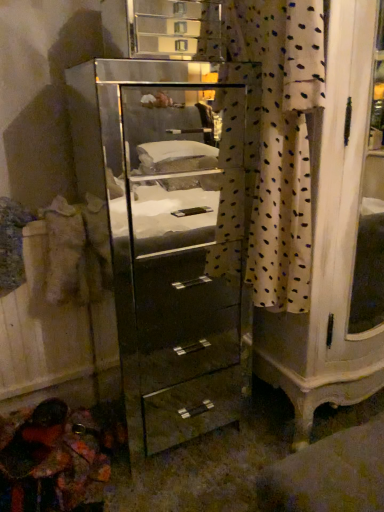
Question: Should I look upward or downward to see white dotted fabric at center?

Choices:
 (A) up
 (B) down

Answer: (A)

Question: Does mirror-finished glass chest of drawers at center have a smaller size compared to white dotted fabric at center?

Choices:
 (A) no
 (B) yes

Answer: (A)

Question: Is mirror-finished glass chest of drawers at center completely or partially outside of white dotted fabric at center?

Choices:
 (A) no
 (B) yes

Answer: (B)

Question: Can you confirm if mirror-finished glass chest of drawers at center is taller than white dotted fabric at center?

Choices:
 (A) yes
 (B) no

Answer: (A)

Question: Could you tell me if mirror-finished glass chest of drawers at center is facing white dotted fabric at center?

Choices:
 (A) no
 (B) yes

Answer: (B)

Question: Does mirror-finished glass chest of drawers at center have a lesser width compared to white dotted fabric at center?

Choices:
 (A) yes
 (B) no

Answer: (B)

Question: Is mirror-finished glass chest of drawers at center bigger than white dotted fabric at center?

Choices:
 (A) no
 (B) yes

Answer: (B)

Question: Would you consider white dotted fabric at center to be distant from mirror-finished glass chest of drawers at center?

Choices:
 (A) yes
 (B) no

Answer: (B)

Question: From the image's perspective, would you say white dotted fabric at center is positioned over mirror-finished glass chest of drawers at center?

Choices:
 (A) yes
 (B) no

Answer: (A)

Question: Does white dotted fabric at center lie in front of mirror-finished glass chest of drawers at center?

Choices:
 (A) yes
 (B) no

Answer: (A)

Question: Is white dotted fabric at center looking in the opposite direction of mirror-finished glass chest of drawers at center?

Choices:
 (A) yes
 (B) no

Answer: (A)

Question: From the image's perspective, is white dotted fabric at center beneath mirror-finished glass chest of drawers at center?

Choices:
 (A) yes
 (B) no

Answer: (B)

Question: Is white dotted fabric at center thinner than mirror-finished glass chest of drawers at center?

Choices:
 (A) yes
 (B) no

Answer: (A)

Question: Considering the positions of mirror-finished glass chest of drawers at center and white dotted fabric at center in the image, is mirror-finished glass chest of drawers at center bigger or smaller than white dotted fabric at center?

Choices:
 (A) big
 (B) small

Answer: (A)